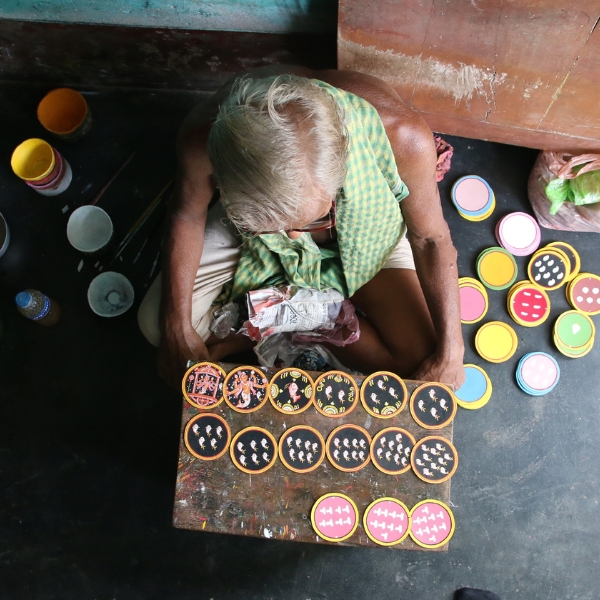
Locate an element on the screen. brown table is located at coordinates (256, 500).